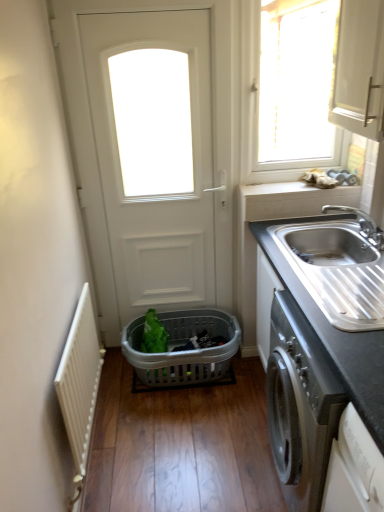
Image resolution: width=384 pixels, height=512 pixels. I want to click on vacant area situated below white painted metal radiator at left (from a real-world perspective), so click(x=95, y=445).